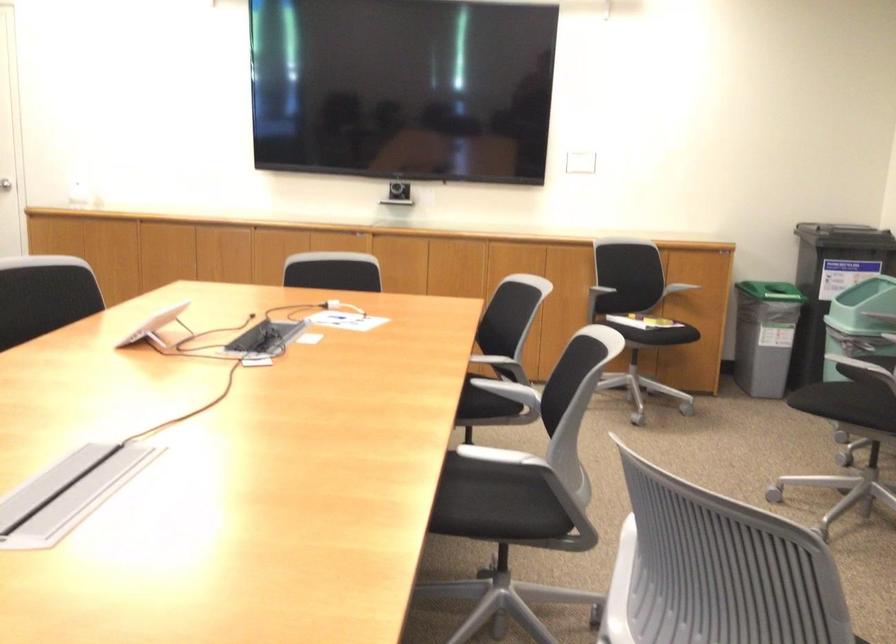
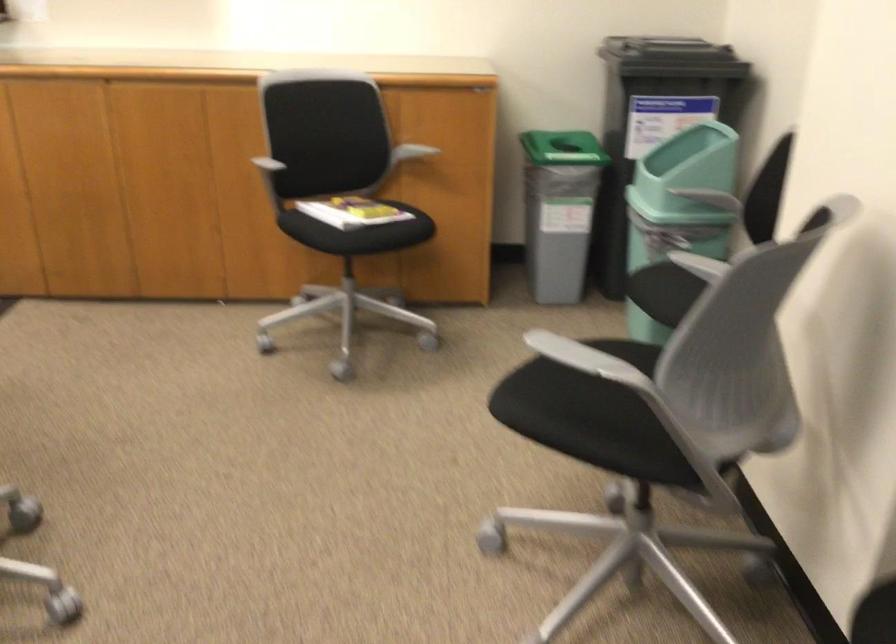
Find the pixel in the second image that matches point (557, 267) in the first image.

(236, 149)